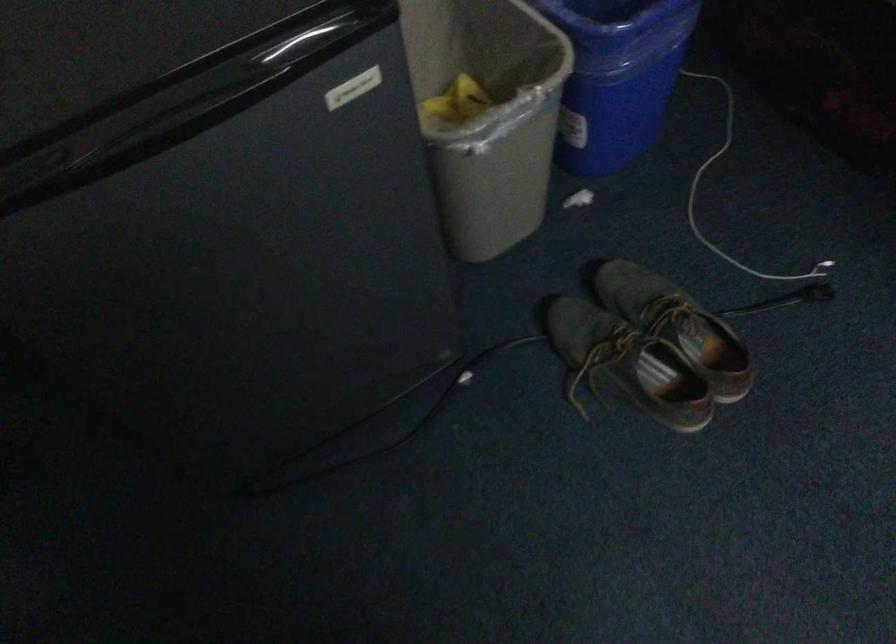
This screenshot has width=896, height=644. I want to click on fridge door handle, so click(309, 40).